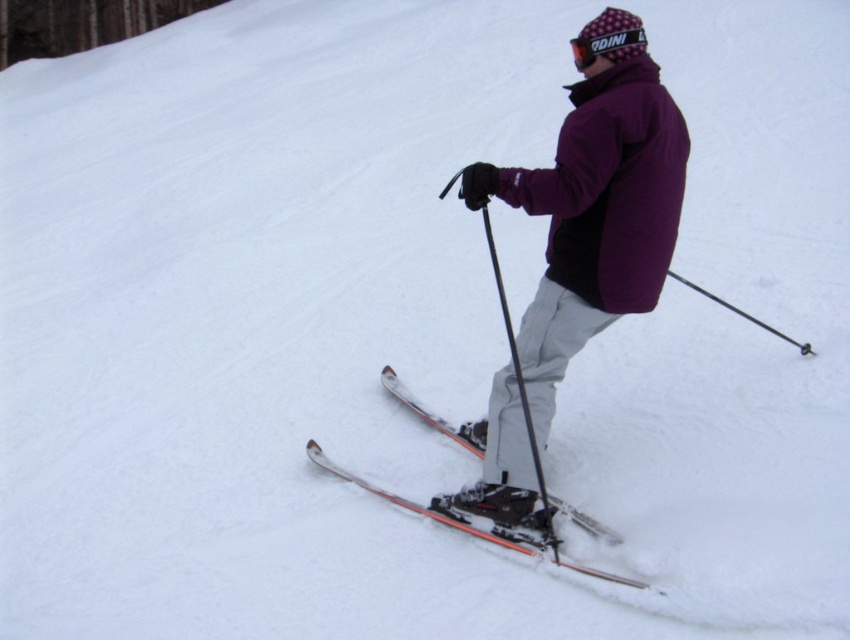
Based on the photo, you are a photographer trying to capture the skier in motion. You want to ensure that both the purple fleece jacket at center and the orange metallic skis at center are clearly visible in your shot. Which object should you focus on first to ensure both are in focus?

The purple fleece jacket at center is positioned on the right side of orange metallic skis at center. Since the jacket is closer to the right side, focusing on it first will help ensure both the jacket and skis remain in focus as they are aligned horizontally.

You are a photographer trying to capture the skier in motion. You want to ensure that both the purple fleece jacket at center and the orange metallic skis at center are clearly visible in your photo. Which object should you focus on to ensure both are in frame?

The purple fleece jacket at center is taller than the orange metallic skis at center, so focusing on the purple fleece jacket at center will ensure both are in frame as it occupies a larger vertical space.

You are a photographer trying to capture a closeup shot of the purple fleece jacket at center and orange metallic skis at center. Which object should you zoom in on to ensure both fit within the frame without cropping?

The purple fleece jacket at center has a lesser width compared to orange metallic skis at center, so you should zoom in on the orange metallic skis at center to ensure both fit within the frame without cropping.